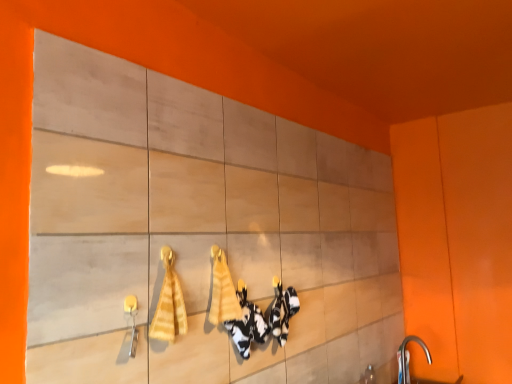
Image resolution: width=512 pixels, height=384 pixels. What do you see at coordinates (404, 367) in the screenshot?
I see `silver metallic faucet at lower right` at bounding box center [404, 367].

Identify the location of silver metallic faucet at lower right. (404, 367).

From a real-world perspective, which object stands above the other?

yellow striped towel at center, which is counted as the second bath towel, starting from the back.

From the image's perspective, which object appears higher, silver metallic faucet at lower right or yellow striped towel at center, which ranks as the first bath towel in front-to-back order?

yellow striped towel at center, which ranks as the first bath towel in front-to-back order.

Is silver metallic faucet at lower right completely or partially outside of yellow striped towel at center, which ranks as the first bath towel in front-to-back order?

Yes, silver metallic faucet at lower right is not within yellow striped towel at center, which ranks as the first bath towel in front-to-back order.

Is point (239, 306) closer to viewer compared to point (179, 310)?

No.

Does yellow fabric bath towel at center, which appears as the second bath towel when viewed from the left, have a lesser width compared to yellow striped towel at center, which ranks as the first bath towel in front-to-back order?

Correct, the width of yellow fabric bath towel at center, which appears as the second bath towel when viewed from the left, is less than that of yellow striped towel at center, which ranks as the first bath towel in front-to-back order.

You are a GUI agent. You are given a task and a screenshot of the screen. Output one action in this format:
    pyautogui.click(x=<x>, y=<y>)
    Task: Click on the bath towel that appears above the yellow fabric bath towel at center, the first bath towel from the right (from a real-world perspective)
    
    Given the screenshot: What is the action you would take?
    pyautogui.click(x=169, y=303)

Could you tell me if yellow fabric bath towel at center, the second bath towel in the front-to-back sequence, is turned towards yellow striped towel at center, which is counted as the second bath towel, starting from the back?

No, yellow fabric bath towel at center, the second bath towel in the front-to-back sequence, does not turn towards yellow striped towel at center, which is counted as the second bath towel, starting from the back.

Between point (87, 209) and point (232, 302), which one is positioned in front?

Positioned in front is point (87, 209).

Is matte wood cabinet at center positioned beyond the bounds of yellow fabric bath towel at center, the first bath towel from the right?

That's correct, matte wood cabinet at center is outside of yellow fabric bath towel at center, the first bath towel from the right.

Does matte wood cabinet at center come behind yellow fabric bath towel at center, which appears as the second bath towel when viewed from the left?

No, matte wood cabinet at center is closer to the viewer.

In the scene shown: Considering the sizes of objects matte wood cabinet at center and yellow fabric bath towel at center, the second bath towel in the front-to-back sequence, in the image provided, who is taller, matte wood cabinet at center or yellow fabric bath towel at center, the second bath towel in the front-to-back sequence,?

With more height is matte wood cabinet at center.

From the image's perspective, is silver metallic faucet at lower right on top of yellow fabric bath towel at center, the first bath towel from the right?

No, from the image's perspective, silver metallic faucet at lower right is not on top of yellow fabric bath towel at center, the first bath towel from the right.

Could you tell me if silver metallic faucet at lower right is facing yellow fabric bath towel at center, the first bath towel from the right?

No, silver metallic faucet at lower right does not turn towards yellow fabric bath towel at center, the first bath towel from the right.

Who is more distant, silver metallic faucet at lower right or yellow fabric bath towel at center, the first bath towel from the right?

silver metallic faucet at lower right is behind.

From the picture: From a real-world perspective, is silver metallic faucet at lower right positioned above or below yellow fabric bath towel at center, the first bath towel from the right?

silver metallic faucet at lower right is situated lower than yellow fabric bath towel at center, the first bath towel from the right, in the real world.

Could you tell me if yellow striped towel at center, which is counted as the second bath towel, starting from the back, is facing yellow fabric bath towel at center, which appears as the second bath towel when viewed from the left?

No, yellow striped towel at center, which is counted as the second bath towel, starting from the back, is not turned towards yellow fabric bath towel at center, which appears as the second bath towel when viewed from the left.

Where is `bath towel below the yellow striped towel at center, which ranks as the first bath towel in front-to-back order (from a real-world perspective)`? The width and height of the screenshot is (512, 384). bath towel below the yellow striped towel at center, which ranks as the first bath towel in front-to-back order (from a real-world perspective) is located at coordinates (222, 291).

From a real-world perspective, does yellow striped towel at center, which is counted as the second bath towel, starting from the back, stand above yellow fabric bath towel at center, the first bath towel from the right?

Yes, from a real-world perspective, yellow striped towel at center, which is counted as the second bath towel, starting from the back, is on top of yellow fabric bath towel at center, the first bath towel from the right.

Considering the relative positions of yellow striped towel at center, arranged as the 2th bath towel when viewed from the right, and yellow fabric bath towel at center, the first bath towel from the right, in the image provided, is yellow striped towel at center, arranged as the 2th bath towel when viewed from the right, in front of yellow fabric bath towel at center, the first bath towel from the right,?

That is True.

Can you tell me how much matte wood cabinet at center and silver metallic faucet at lower right differ in facing direction?

The angular difference between matte wood cabinet at center and silver metallic faucet at lower right is 3.75 degrees.

Does matte wood cabinet at center have a larger size compared to silver metallic faucet at lower right?

Correct, matte wood cabinet at center is larger in size than silver metallic faucet at lower right.

Could silver metallic faucet at lower right be considered to be inside matte wood cabinet at center?

Definitely not — silver metallic faucet at lower right is not inside matte wood cabinet at center.

Is matte wood cabinet at center aimed at silver metallic faucet at lower right?

Yes, matte wood cabinet at center is facing silver metallic faucet at lower right.

Looking at this image, between yellow striped towel at center, arranged as the 1th bath towel when viewed from the left, and silver metallic faucet at lower right, which one appears on the left side from the viewer's perspective?

Positioned to the left is yellow striped towel at center, arranged as the 1th bath towel when viewed from the left.

In the scene shown: Is yellow striped towel at center, arranged as the 2th bath towel when viewed from the right, smaller than silver metallic faucet at lower right?

Correct, yellow striped towel at center, arranged as the 2th bath towel when viewed from the right, occupies less space than silver metallic faucet at lower right.

Considering the positions of objects yellow striped towel at center, arranged as the 1th bath towel when viewed from the left, and silver metallic faucet at lower right in the image provided, who is behind, yellow striped towel at center, arranged as the 1th bath towel when viewed from the left, or silver metallic faucet at lower right?

silver metallic faucet at lower right is further from the camera.

From a real-world perspective, does yellow striped towel at center, which ranks as the first bath towel in front-to-back order, stand above silver metallic faucet at lower right?

Correct, in the physical world, yellow striped towel at center, which ranks as the first bath towel in front-to-back order, is higher than silver metallic faucet at lower right.

At what (x,y) coordinates should I click in order to perform the action: click on sink on the right of yellow striped towel at center, arranged as the 1th bath towel when viewed from the left. Please return your answer as a coordinate pair (x, y). Looking at the image, I should click on (404, 367).

The width and height of the screenshot is (512, 384). I want to click on bath towel below the yellow striped towel at center, arranged as the 2th bath towel when viewed from the right (from a real-world perspective), so click(x=222, y=291).

Based on their spatial positions, is yellow striped towel at center, which ranks as the first bath towel in front-to-back order, or silver metallic faucet at lower right closer to matte wood cabinet at center?

Among the two, yellow striped towel at center, which ranks as the first bath towel in front-to-back order, is located nearer to matte wood cabinet at center.

Considering their positions, is yellow fabric bath towel at center, the second bath towel in the front-to-back sequence, positioned closer to matte wood cabinet at center than silver metallic faucet at lower right?

Based on the image, yellow fabric bath towel at center, the second bath towel in the front-to-back sequence, appears to be nearer to matte wood cabinet at center.

Based on their spatial positions, is yellow fabric bath towel at center, the 1th bath towel from the back, or yellow striped towel at center, which ranks as the first bath towel in front-to-back order, closer to matte wood cabinet at center?

yellow fabric bath towel at center, the 1th bath towel from the back, lies closer to matte wood cabinet at center than the other object.

Estimate the real-world distances between objects in this image. Which object is closer to matte wood cabinet at center, silver metallic faucet at lower right or yellow fabric bath towel at center, the 1th bath towel from the back?

yellow fabric bath towel at center, the 1th bath towel from the back, is positioned closer to the anchor matte wood cabinet at center.

When comparing their distances from yellow striped towel at center, arranged as the 2th bath towel when viewed from the right, does silver metallic faucet at lower right or matte wood cabinet at center seem closer?

matte wood cabinet at center.

Based on the photo, based on their spatial positions, is yellow fabric bath towel at center, the first bath towel from the right, or yellow striped towel at center, arranged as the 2th bath towel when viewed from the right, closer to silver metallic faucet at lower right?

The object closer to silver metallic faucet at lower right is yellow fabric bath towel at center, the first bath towel from the right.

Based on their spatial positions, is matte wood cabinet at center or yellow fabric bath towel at center, the 1th bath towel from the back, closer to silver metallic faucet at lower right?

The object closer to silver metallic faucet at lower right is matte wood cabinet at center.

From the image, which object appears to be farther from yellow fabric bath towel at center, the first bath towel from the right, yellow striped towel at center, arranged as the 1th bath towel when viewed from the left, or matte wood cabinet at center?

The object further to yellow fabric bath towel at center, the first bath towel from the right, is matte wood cabinet at center.

Identify the location of bath towel between yellow striped towel at center, arranged as the 2th bath towel when viewed from the right, and silver metallic faucet at lower right from left to right. (222, 291).

Identify the location of bath towel located between matte wood cabinet at center and yellow fabric bath towel at center, the 1th bath towel from the back, in the depth direction. The height and width of the screenshot is (384, 512). (169, 303).